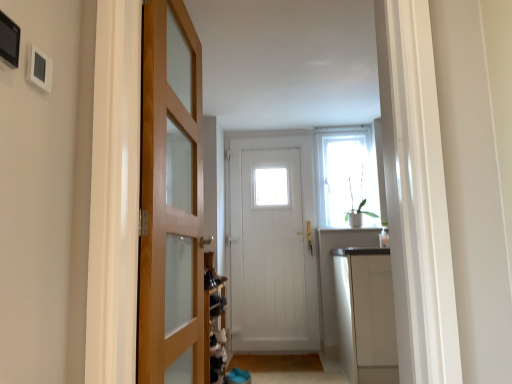
Identify the location of blank space above clear glass window at upper center (from a real-world perspective). This screenshot has height=384, width=512. (348, 128).